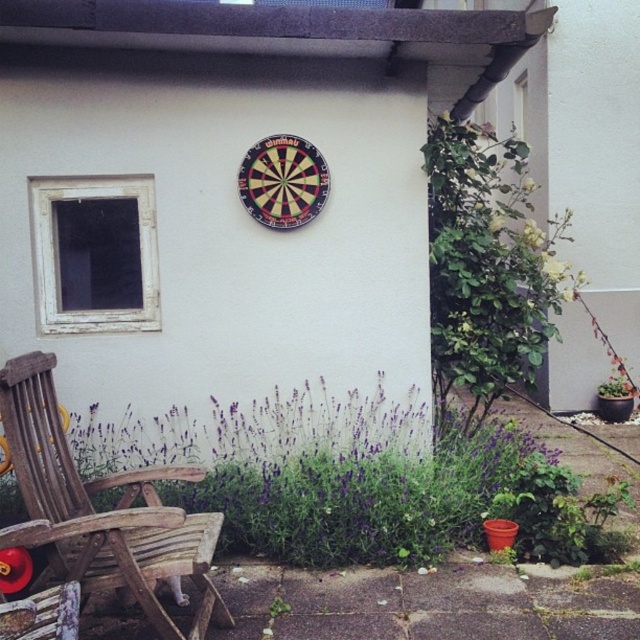
Question: Is purple wood lavender at lower center bigger than wooden rocking chair at lower left?

Choices:
 (A) yes
 (B) no

Answer: (A)

Question: Among these objects, which one is nearest to the camera?

Choices:
 (A) purple wood lavender at lower center
 (B) wooden rocking chair at lower left

Answer: (B)

Question: Which of the following is the closest to the observer?

Choices:
 (A) (156, 518)
 (B) (456, 483)

Answer: (A)

Question: From the image, what is the correct spatial relationship of purple wood lavender at lower center in relation to wooden rocking chair at lower left?

Choices:
 (A) right
 (B) left

Answer: (A)

Question: Which point is farther to the camera?

Choices:
 (A) (580, 509)
 (B) (196, 468)

Answer: (A)

Question: Is purple wood lavender at lower center further to the viewer compared to wooden rocking chair at lower left?

Choices:
 (A) no
 (B) yes

Answer: (B)